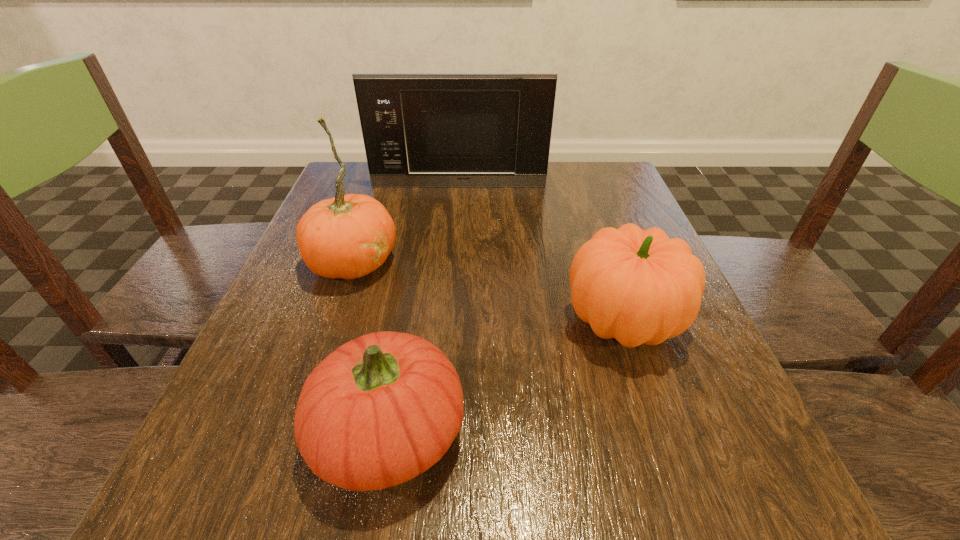
The width and height of the screenshot is (960, 540). I want to click on the farthest object, so click(x=420, y=130).

You are a GUI agent. You are given a task and a screenshot of the screen. Output one action in this format:
    pyautogui.click(x=<x>, y=<y>)
    Task: Click on the tallest pumpkin
    
    Given the screenshot: What is the action you would take?
    tap(348, 236)

The width and height of the screenshot is (960, 540). I want to click on the rightmost pumpkin, so point(636,286).

The height and width of the screenshot is (540, 960). What are the coordinates of `the nearest pumpkin` in the screenshot? It's located at (381, 409).

You are a GUI agent. You are given a task and a screenshot of the screen. Output one action in this format:
    pyautogui.click(x=<x>, y=<y>)
    Task: Click on the vacant space positioned on the front panel of the microwave oven
    Image resolution: width=960 pixels, height=540 pixels.
    Given the screenshot: What is the action you would take?
    pyautogui.click(x=458, y=205)

Locate an element on the screen. The image size is (960, 540). vacant position located 0.230m on the right of the tallest pumpkin is located at coordinates (514, 261).

Find the location of `vacant space situated 0.150m on the left of the rightmost pumpkin`. vacant space situated 0.150m on the left of the rightmost pumpkin is located at coordinates (476, 321).

Where is `free space located on the back of the nearest pumpkin`? This screenshot has width=960, height=540. free space located on the back of the nearest pumpkin is located at coordinates (420, 246).

Find the location of a particular element. The width and height of the screenshot is (960, 540). object at the far edge is located at coordinates click(x=420, y=130).

Where is `object that is at the near edge`? object that is at the near edge is located at coordinates pos(381,409).